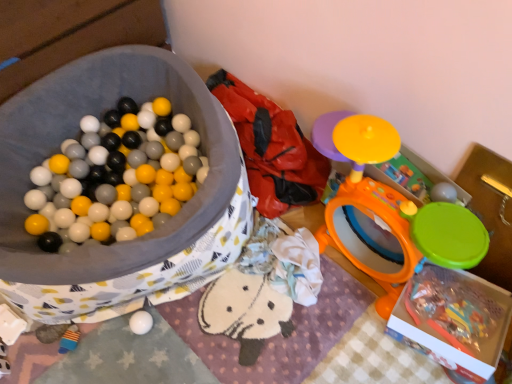
Describe the element at coordinates (127, 241) in the screenshot. I see `matte plastic ball pit at left, arranged as the first storage box when viewed from the left` at that location.

Describe the element at coordinates (141, 322) in the screenshot. I see `white matte ball at lower center, positioned as the 3th toy in top-to-bottom order` at that location.

Find the location of a particular element. translucent plastic storage box at lower right, the first storage box in the right-to-left sequence is located at coordinates [454, 318].

In order to face smooth plastic toy at lower left, arranged as the 4th toy when viewed from the top, should I rotate leftwards or rightwards?

To align with it, rotate left about 23.552°.

Where is `matte plastic ball pit at left, arranged as the first storage box when viewed from the left`? The image size is (512, 384). matte plastic ball pit at left, arranged as the first storage box when viewed from the left is located at coordinates (127, 241).

Which of these two, translucent plastic storage box at lower right, the first storage box in the right-to-left sequence, or smooth plastic toy at lower left, which ranks as the first toy in bottom-to-top order, stands shorter?

smooth plastic toy at lower left, which ranks as the first toy in bottom-to-top order.

From a real-world perspective, is translucent plastic storage box at lower right, the second storage box when ordered from left to right, physically located above or below smooth plastic toy at lower left, the fourth toy in the right-to-left sequence?

translucent plastic storage box at lower right, the second storage box when ordered from left to right, is above smooth plastic toy at lower left, the fourth toy in the right-to-left sequence.

Is point (394, 314) closer or farther from the camera than point (64, 337)?

Clearly, point (394, 314) is closer to the camera than point (64, 337).

Are smooth plastic toy at lower left, which ranks as the first toy in bottom-to-top order, and white matte ball at lower center, which ranks as the 2th toy in left-to-right order, making contact?

No, smooth plastic toy at lower left, which ranks as the first toy in bottom-to-top order, is not beside white matte ball at lower center, which ranks as the 2th toy in left-to-right order.

From the image's perspective, is smooth plastic toy at lower left, arranged as the 4th toy when viewed from the top, beneath white matte ball at lower center, which ranks as the 2th toy in left-to-right order?

Correct, smooth plastic toy at lower left, arranged as the 4th toy when viewed from the top, appears lower than white matte ball at lower center, which ranks as the 2th toy in left-to-right order, in the image.

Could you tell me if smooth plastic toy at lower left, the fourth toy in the right-to-left sequence, is facing white matte ball at lower center, which ranks as the 2th toy in left-to-right order?

No.

Does point (71, 336) lie in front of point (143, 334)?

Yes, it is.

From a real-world perspective, is white matte ball at lower center, which ranks as the 2th toy in left-to-right order, physically below smooth plastic toy at lower left, the fourth toy in the right-to-left sequence?

No, from a real-world perspective, white matte ball at lower center, which ranks as the 2th toy in left-to-right order, is not beneath smooth plastic toy at lower left, the fourth toy in the right-to-left sequence.

Is point (130, 326) closer to viewer compared to point (69, 332)?

No, it is behind (69, 332).

How distant is white matte ball at lower center, marked as the third toy in a right-to-left arrangement, from smooth plastic toy at lower left, the fourth toy in the right-to-left sequence?

white matte ball at lower center, marked as the third toy in a right-to-left arrangement, and smooth plastic toy at lower left, the fourth toy in the right-to-left sequence, are 7.56 inches apart from each other.

Locate an element on the screen. The image size is (512, 384). toy behind the white matte ball at lower center, marked as the third toy in a right-to-left arrangement is located at coordinates (69, 339).

From the image's perspective, would you say orange plastic drum at upper right, which is the third toy in bottom-to-top order, is shown under smooth plastic toy at lower left, arranged as the 4th toy when viewed from the top?

No, from the image's perspective, orange plastic drum at upper right, which is the third toy in bottom-to-top order, is not beneath smooth plastic toy at lower left, arranged as the 4th toy when viewed from the top.

In the scene shown: In the image, is orange plastic drum at upper right, positioned as the second toy in right-to-left order, positioned in front of or behind smooth plastic toy at lower left, the fourth toy in the right-to-left sequence?

In the image, orange plastic drum at upper right, positioned as the second toy in right-to-left order, appears in front of smooth plastic toy at lower left, the fourth toy in the right-to-left sequence.

Does point (348, 155) lie behind point (77, 333)?

That is False.

Would you say orange plastic drum at upper right, which is the 2th toy from top to bottom, is to the left or to the right of smooth plastic toy at lower left, arranged as the 4th toy when viewed from the top, in the picture?

Clearly, orange plastic drum at upper right, which is the 2th toy from top to bottom, is on the right of smooth plastic toy at lower left, arranged as the 4th toy when viewed from the top, in the image.

From a real-world perspective, is matte yellow plastic toy at upper right, the 1th toy positioned from the top, physically located above or below orange plastic drum at upper right, positioned as the second toy in right-to-left order?

In terms of real-world spatial position, matte yellow plastic toy at upper right, the 1th toy positioned from the top, is above orange plastic drum at upper right, positioned as the second toy in right-to-left order.

Looking at their sizes, would you say matte yellow plastic toy at upper right, the 1th toy positioned from the top, is wider or thinner than orange plastic drum at upper right, the 3th toy positioned from the left?

matte yellow plastic toy at upper right, the 1th toy positioned from the top, is thinner than orange plastic drum at upper right, the 3th toy positioned from the left.

You are a GUI agent. You are given a task and a screenshot of the screen. Output one action in this format:
    pyautogui.click(x=<x>, y=<y>)
    Task: Click on the 1st toy behind the orange plastic drum at upper right, which is the 2th toy from top to bottom, counting from the anchor's position
    This screenshot has height=384, width=512.
    Given the screenshot: What is the action you would take?
    407,176

From the image's perspective, between matte yellow plastic toy at upper right, marked as the fourth toy in a left-to-right arrangement, and orange plastic drum at upper right, positioned as the second toy in right-to-left order, which one is located above?

matte yellow plastic toy at upper right, marked as the fourth toy in a left-to-right arrangement, from the image's perspective.

Measure the distance from matte yellow plastic toy at upper right, marked as the fourth toy in a left-to-right arrangement, to white matte ball at lower center, marked as the third toy in a right-to-left arrangement.

matte yellow plastic toy at upper right, marked as the fourth toy in a left-to-right arrangement, is 35.45 inches from white matte ball at lower center, marked as the third toy in a right-to-left arrangement.

From a real-world perspective, which is physically above, matte yellow plastic toy at upper right, which appears as the fourth toy when ordered from the bottom, or white matte ball at lower center, positioned as the 3th toy in top-to-bottom order?

In real-world perspective, matte yellow plastic toy at upper right, which appears as the fourth toy when ordered from the bottom, is above.

Consider the image. Between matte yellow plastic toy at upper right, marked as the fourth toy in a left-to-right arrangement, and white matte ball at lower center, marked as the third toy in a right-to-left arrangement, which one has smaller size?

white matte ball at lower center, marked as the third toy in a right-to-left arrangement, is smaller.

Would you say translucent plastic storage box at lower right, the first storage box in the right-to-left sequence, is outside matte yellow plastic toy at upper right, the 1th toy positioned from the right?

Indeed, translucent plastic storage box at lower right, the first storage box in the right-to-left sequence, is completely outside matte yellow plastic toy at upper right, the 1th toy positioned from the right.

Does translucent plastic storage box at lower right, the first storage box in the right-to-left sequence, have a greater height compared to matte yellow plastic toy at upper right, the 1th toy positioned from the right?

No.

What are the coordinates of `toy that is the 4th one when counting leftward from the translucent plastic storage box at lower right, the first storage box in the right-to-left sequence` in the screenshot? It's located at (69, 339).

Locate an element on the screen. This screenshot has width=512, height=384. toy behind the white matte ball at lower center, marked as the third toy in a right-to-left arrangement is located at coordinates (69, 339).

From the picture: Based on their spatial positions, is smooth plastic toy at lower left, arranged as the 4th toy when viewed from the top, or matte plastic ball pit at left, arranged as the first storage box when viewed from the left, closer to soft fabric bean bag at center?

matte plastic ball pit at left, arranged as the first storage box when viewed from the left, is positioned closer to the anchor soft fabric bean bag at center.

Based on the photo, which object lies nearer to the anchor point soft fabric bean bag at center, smooth plastic toy at lower left, the fourth toy in the right-to-left sequence, or white matte ball at lower center, which is the second toy in bottom-to-top order?

white matte ball at lower center, which is the second toy in bottom-to-top order, is positioned closer to the anchor soft fabric bean bag at center.

Looking at the image, which one is located further to white matte ball at lower center, marked as the third toy in a right-to-left arrangement, soft fabric bean bag at center or matte yellow plastic toy at upper right, which appears as the fourth toy when ordered from the bottom?

Among the two, matte yellow plastic toy at upper right, which appears as the fourth toy when ordered from the bottom, is located further to white matte ball at lower center, marked as the third toy in a right-to-left arrangement.

Estimate the real-world distances between objects in this image. Which object is closer to translucent plastic storage box at lower right, the second storage box when ordered from left to right, orange plastic drum at upper right, positioned as the second toy in right-to-left order, or white matte ball at lower center, which is the second toy in bottom-to-top order?

orange plastic drum at upper right, positioned as the second toy in right-to-left order, lies closer to translucent plastic storage box at lower right, the second storage box when ordered from left to right, than the other object.

When comparing their distances from smooth plastic toy at lower left, which ranks as the first toy in bottom-to-top order, does matte plastic ball pit at left, arranged as the first storage box when viewed from the left, or orange plastic drum at upper right, the 3th toy positioned from the left, seem further?

The object further to smooth plastic toy at lower left, which ranks as the first toy in bottom-to-top order, is orange plastic drum at upper right, the 3th toy positioned from the left.

Looking at the image, which one is located closer to matte yellow plastic toy at upper right, the 1th toy positioned from the top, matte plastic ball pit at left, arranged as the first storage box when viewed from the left, or white matte ball at lower center, positioned as the 3th toy in top-to-bottom order?

matte plastic ball pit at left, arranged as the first storage box when viewed from the left, is closer to matte yellow plastic toy at upper right, the 1th toy positioned from the top.

Looking at the image, which one is located closer to translucent plastic storage box at lower right, the second storage box when ordered from left to right, orange plastic drum at upper right, positioned as the second toy in right-to-left order, or smooth plastic toy at lower left, arranged as the 4th toy when viewed from the top?

The object closer to translucent plastic storage box at lower right, the second storage box when ordered from left to right, is orange plastic drum at upper right, positioned as the second toy in right-to-left order.

Based on their spatial positions, is soft fabric bean bag at center or matte plastic ball pit at left, arranged as the first storage box when viewed from the left, closer to translucent plastic storage box at lower right, the second storage box when ordered from left to right?

soft fabric bean bag at center.

Find the location of a particular element. storage box situated between smooth plastic toy at lower left, arranged as the 4th toy when viewed from the top, and matte yellow plastic toy at upper right, which appears as the fourth toy when ordered from the bottom, from left to right is located at coordinates (127, 241).

Where is `bean bag chair situated between white matte ball at lower center, positioned as the 3th toy in top-to-bottom order, and translucent plastic storage box at lower right, the first storage box in the right-to-left sequence, from left to right`? The width and height of the screenshot is (512, 384). bean bag chair situated between white matte ball at lower center, positioned as the 3th toy in top-to-bottom order, and translucent plastic storage box at lower right, the first storage box in the right-to-left sequence, from left to right is located at coordinates (271, 148).

Where is `bean bag chair situated between smooth plastic toy at lower left, the fourth toy in the right-to-left sequence, and translucent plastic storage box at lower right, the second storage box when ordered from left to right, from left to right`? Image resolution: width=512 pixels, height=384 pixels. bean bag chair situated between smooth plastic toy at lower left, the fourth toy in the right-to-left sequence, and translucent plastic storage box at lower right, the second storage box when ordered from left to right, from left to right is located at coordinates (271, 148).

Identify the location of bean bag chair situated between smooth plastic toy at lower left, which ranks as the first toy in bottom-to-top order, and matte yellow plastic toy at upper right, the 1th toy positioned from the right, from left to right. This screenshot has height=384, width=512. (271, 148).